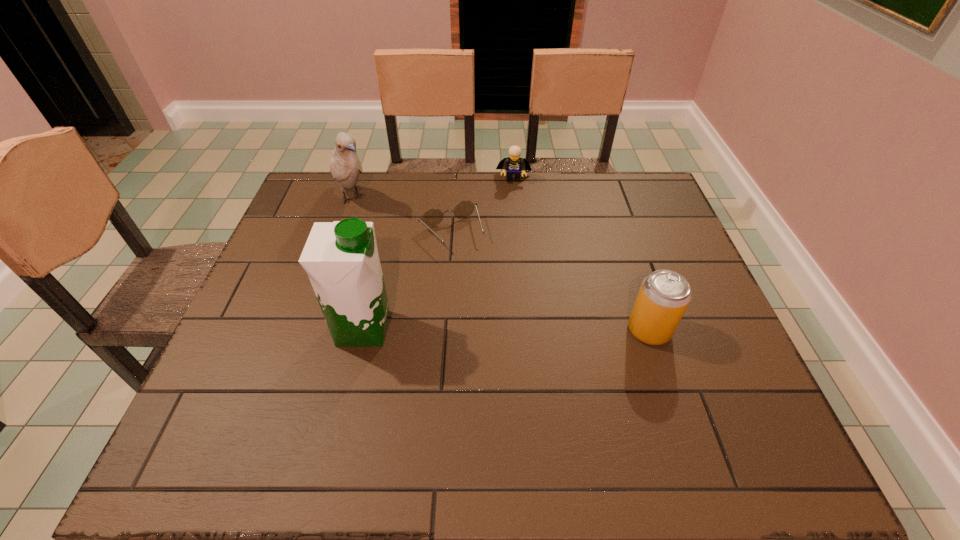
Where is `vacant space that's between the tallest object and the second object from right to left`? The width and height of the screenshot is (960, 540). vacant space that's between the tallest object and the second object from right to left is located at coordinates (439, 253).

You are a GUI agent. You are given a task and a screenshot of the screen. Output one action in this format:
    pyautogui.click(x=<x>, y=<y>)
    Task: Click on the object that stands as the third closest to the tallest object
    
    Given the screenshot: What is the action you would take?
    pyautogui.click(x=664, y=295)

Choose which object is the fourth nearest neighbor to the spectacles. Please provide its 2D coordinates. Your answer should be formatted as a tuple, i.e. [(x, y)], where the tuple contains the x and y coordinates of a point satisfying the conditions above.

[(664, 295)]

You are a GUI agent. You are given a task and a screenshot of the screen. Output one action in this format:
    pyautogui.click(x=<x>, y=<y>)
    Task: Click on the free location that satisfies the following two spatial constraints: 1. on the front side of the tallest object; 2. on the front-facing side of the fourth shortest object
    The width and height of the screenshot is (960, 540).
    Given the screenshot: What is the action you would take?
    pyautogui.click(x=308, y=328)